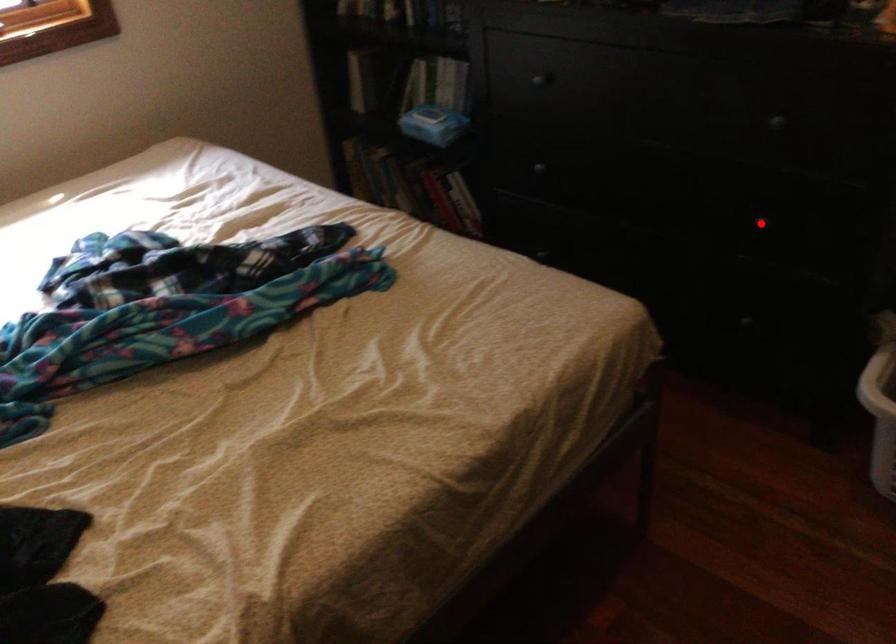
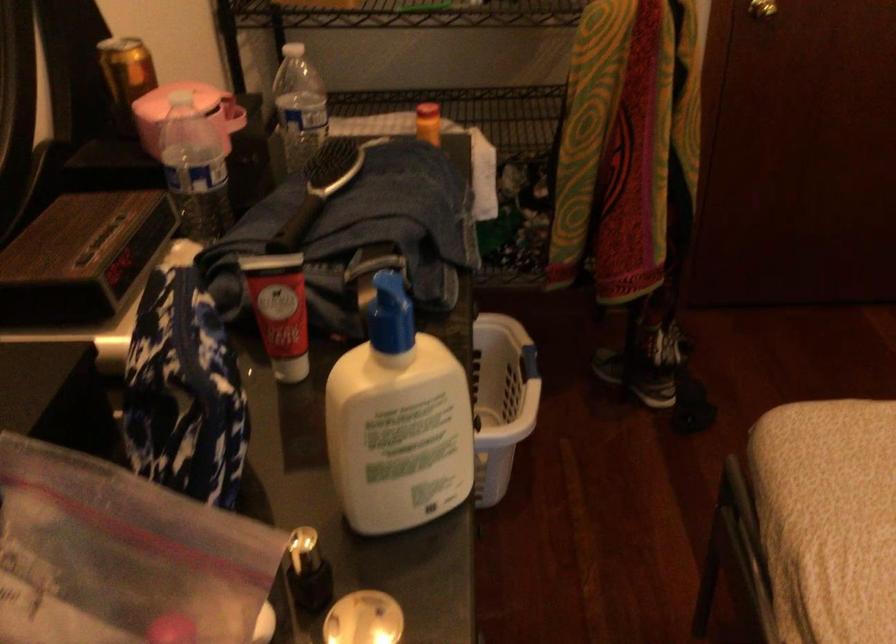
Question: I am providing you with two images of the same scene from different viewpoints. A red point is marked on the first image. Is the red point's position out of view in image 2?

Choices:
 (A) Yes
 (B) No

Answer: (A)